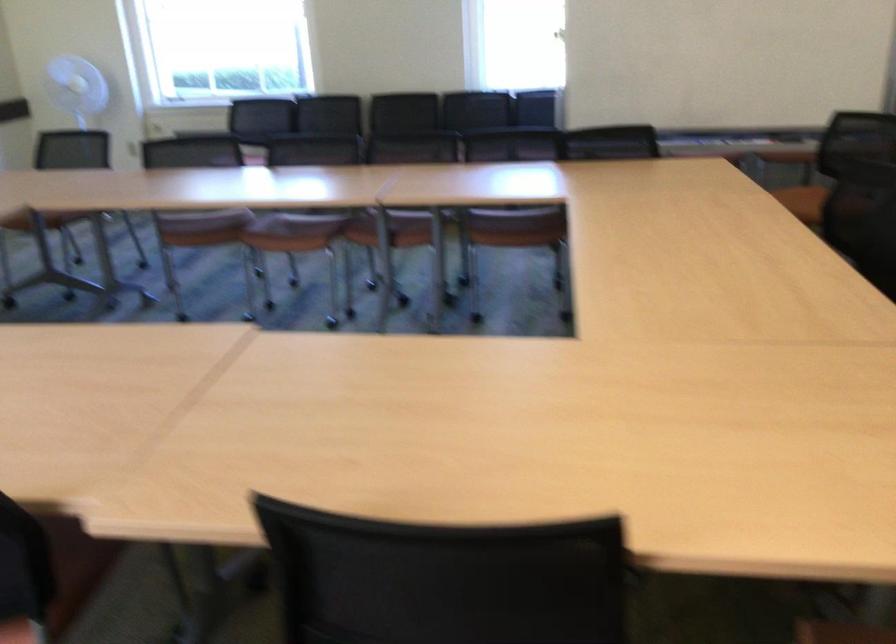
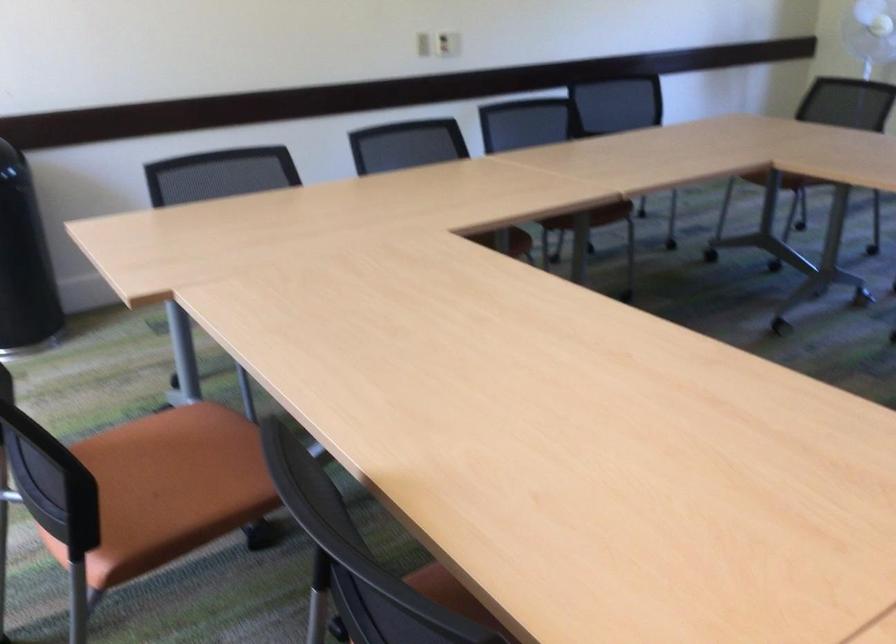
Question: The camera is either moving clockwise (left) or counter-clockwise (right) around the object. The first image is from the beginning of the video and the second image is from the end. Is the camera moving left or right when shooting the video?

Choices:
 (A) Left
 (B) Right

Answer: (B)